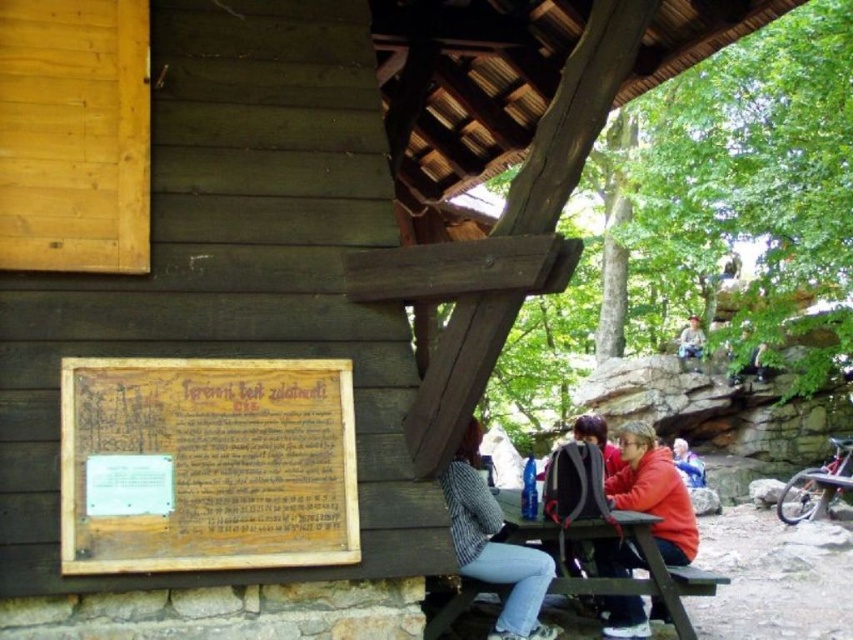
Does wooden sign at left appear on the right side of wooden picnic table at center?

In fact, wooden sign at left is to the left of wooden picnic table at center.

Which is behind, point (125, 429) or point (648, 531)?

The point (648, 531) is behind.

Is point (94, 513) positioned before point (641, 536)?

Yes, it is.

Where is `wooden sign at left`? wooden sign at left is located at coordinates (206, 465).

Can you confirm if wooden sign at left is positioned below blue denim jacket at lower right?

No.

Is wooden sign at left positioned behind blue denim jacket at lower right?

No, wooden sign at left is closer to the viewer.

Does point (160, 404) lie in front of point (672, 451)?

Yes, point (160, 404) is in front of point (672, 451).

Identify the location of wooden sign at left. (206, 465).

Looking at this image, who is more distant from viewer, (x=618, y=577) or (x=688, y=460)?

Positioned behind is point (x=688, y=460).

Is brown wooden bench at lower center wider than blue denim jacket at lower right?

Yes, brown wooden bench at lower center is wider than blue denim jacket at lower right.

What do you see at coordinates (650, 588) in the screenshot? I see `brown wooden bench at lower center` at bounding box center [650, 588].

Locate an element on the screen. brown wooden bench at lower center is located at coordinates (650, 588).